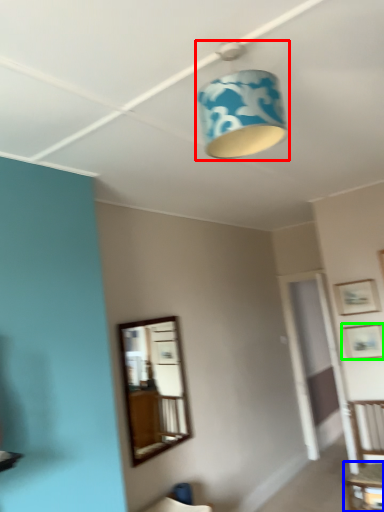
Question: Which object is the closest to the lamp (highlighted by a red box)? Choose among these: table (highlighted by a blue box) or picture frame (highlighted by a green box).

Choices:
 (A) table
 (B) picture frame

Answer: (B)